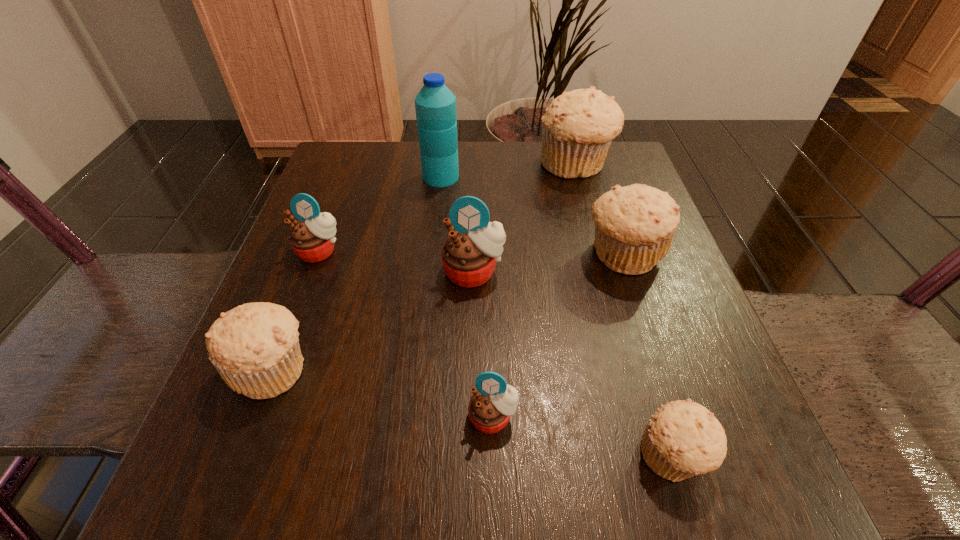
You are a GUI agent. You are given a task and a screenshot of the screen. Output one action in this format:
    pyautogui.click(x=<x>, y=<y>)
    Task: Click on the nearest beige muffin
    Image resolution: width=960 pixels, height=540 pixels.
    Given the screenshot: What is the action you would take?
    pyautogui.click(x=682, y=439)

Identify the location of vacant space located on the front of the tallest object. The image size is (960, 540). (432, 258).

You are a GUI agent. You are given a task and a screenshot of the screen. Output one action in this format:
    pyautogui.click(x=<x>, y=<y>)
    Task: Click on the vacant space located on the left of the farthest muffin
    This screenshot has width=960, height=540.
    Given the screenshot: What is the action you would take?
    pyautogui.click(x=377, y=165)

Image resolution: width=960 pixels, height=540 pixels. Identify the location of vacant space positioned 0.050m on the front-facing side of the biggest pink muffin. (473, 314).

In order to click on vacant space located on the left of the third nearest beige muffin in this screenshot , I will do `click(505, 255)`.

You are a GUI agent. You are given a task and a screenshot of the screen. Output one action in this format:
    pyautogui.click(x=<x>, y=<y>)
    Task: Click on the free space located 0.280m on the front-facing side of the leftmost pink muffin
    The width and height of the screenshot is (960, 540).
    Given the screenshot: What is the action you would take?
    pyautogui.click(x=262, y=406)

At what (x,y) coordinates should I click in order to perform the action: click on vacant space located 0.090m on the front of the second nearest beige muffin. Please return your answer as a coordinate pair (x, y). Looking at the image, I should click on coord(233,469).

At what (x,y) coordinates should I click in order to perform the action: click on free space located 0.100m on the front-facing side of the smallest pink muffin. Please return your answer as a coordinate pair (x, y). This screenshot has height=540, width=960. Looking at the image, I should click on (495, 521).

I want to click on blank area located on the back of the nearest beige muffin, so click(x=653, y=390).

Find the location of a particular element. Image resolution: width=960 pixels, height=540 pixels. water bottle located in the far edge section of the desktop is located at coordinates (435, 105).